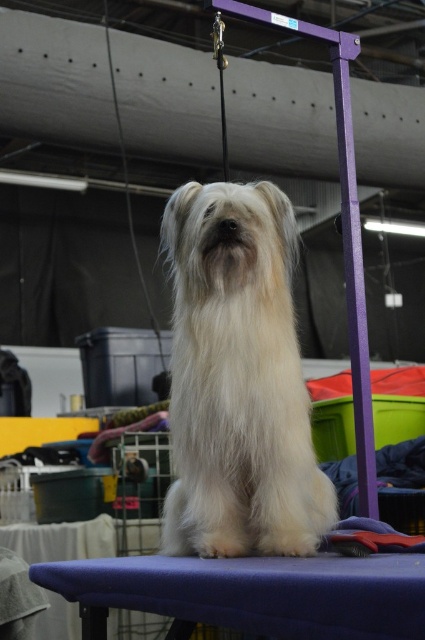
Who is taller, white fluffy dog at center or blue fabric stool at lower center?

white fluffy dog at center is taller.

Between white fluffy dog at center and blue fabric stool at lower center, which one is positioned higher?

white fluffy dog at center is higher up.

Which is behind, point (257, 294) or point (218, 568)?

Positioned behind is point (257, 294).

Where is `white fluffy dog at center`? The height and width of the screenshot is (640, 425). white fluffy dog at center is located at coordinates (238, 380).